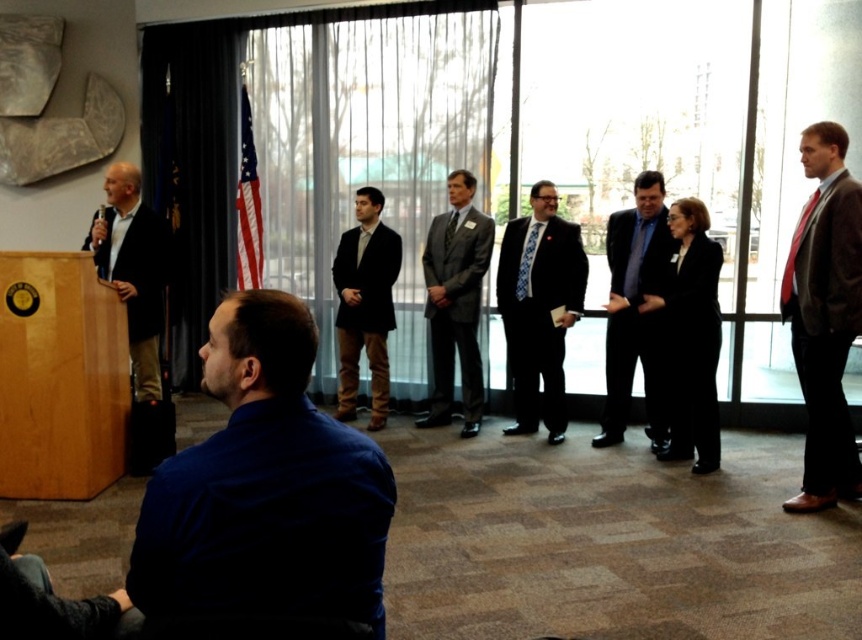
You are standing in the conference room and notice two points marked in the image. Which point, point 1 at coordinates [836,269] or point 2 at coordinates [128,280], is closer to you?

Point 1 at coordinates [836,269] is closer to the viewer than point 2 at coordinates [128,280].

You are a photographer positioned at the back of the room and want to capture a clear photo of the gray suit at center and the dark gray wool suit at left. Which suit will appear closer to the camera in the photo?

The gray suit at center will appear closer to the camera in the photo because it is positioned further to the viewer than the dark gray wool suit at left.

You are a photographer in the conference room and want to capture a photo of the gray suit at center and the dark gray wool suit at left. Based on their sizes, which one would appear larger in the photo?

The gray suit at center would appear larger in the photo because it is taller than the dark gray wool suit at left.